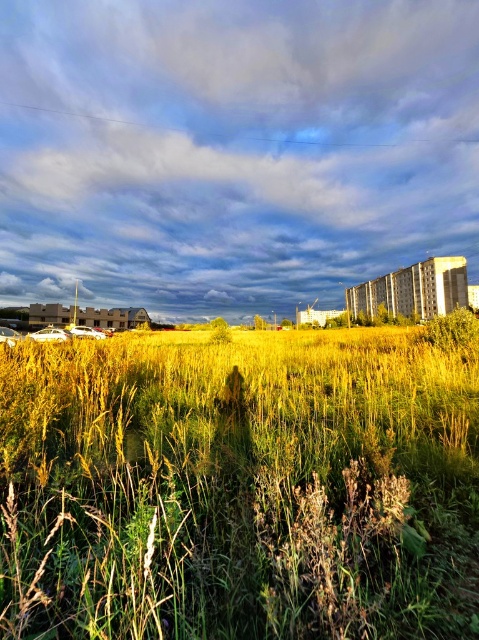
You are standing in the field and see the yellow grass at center and the cloudy sky at upper center. Which object is positioned to the left of the other?

The cloudy sky at upper center is positioned to the left of the yellow grass at center.

You are standing in the field and want to take a photo of the yellow grass at center and the cloudy sky at upper center. Which object will appear smaller in the photo?

Answer: The yellow grass at center will appear smaller in the photo because it has a lesser width compared to the cloudy sky at upper center.